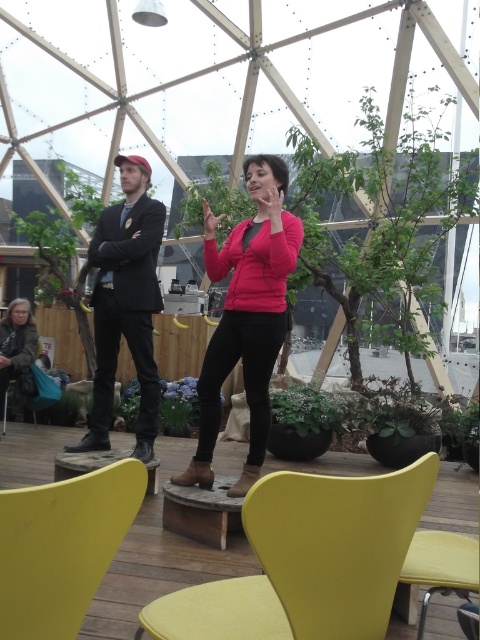
Which is in front, point (324, 520) or point (239, 237)?

Point (324, 520)

Does yellow fabric chair at lower center come in front of matte pink sweater at center?

Yes, yellow fabric chair at lower center is in front of matte pink sweater at center.

Identify the location of yellow fabric chair at lower center. The width and height of the screenshot is (480, 640). (309, 561).

What do you see at coordinates (247, 316) in the screenshot?
I see `matte pink sweater at center` at bounding box center [247, 316].

At what (x,y) coordinates should I click in order to perform the action: click on matte pink sweater at center. Please return your answer as a coordinate pair (x, y). This screenshot has width=480, height=640. Looking at the image, I should click on (247, 316).

Does matte pink sweater at center lie behind matte black suit at left?

No, it is in front of matte black suit at left.

Who is more distant from viewer, (268, 352) or (107, 332)?

Point (107, 332)

Where is `matte pink sweater at center`? matte pink sweater at center is located at coordinates (247, 316).